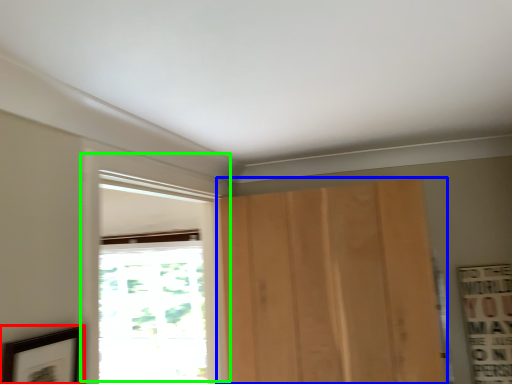
Question: Which is farther away from picture frame (highlighted by a red box)? door (highlighted by a blue box) or window (highlighted by a green box)?

Choices:
 (A) door
 (B) window

Answer: (A)